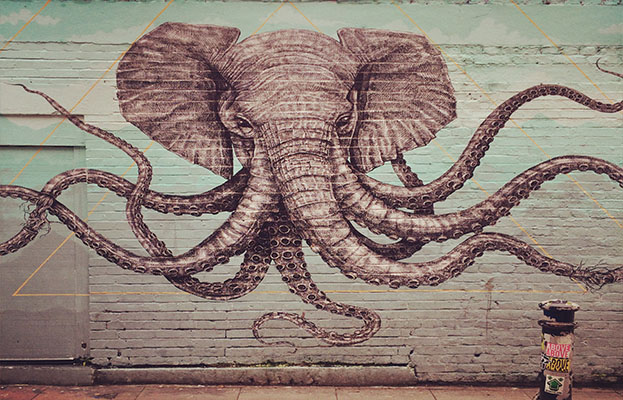
Where is `metal door`? The height and width of the screenshot is (400, 623). metal door is located at coordinates (58, 281).